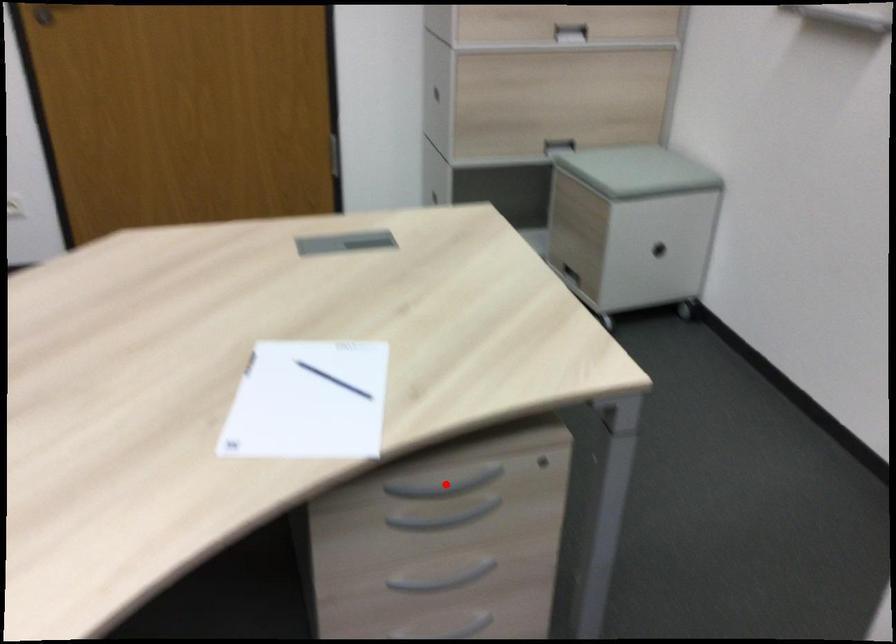
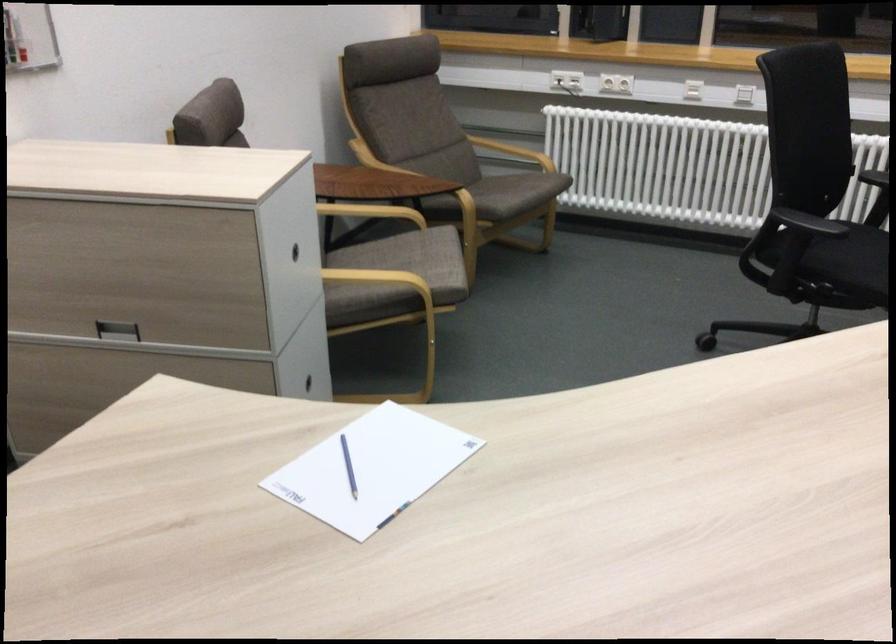
Question: I am providing you with two images of the same scene from different viewpoints. A red point is marked on the first image. At the location where the point appears in image 1, is it still visible in image 2?

Choices:
 (A) Yes
 (B) No

Answer: (B)